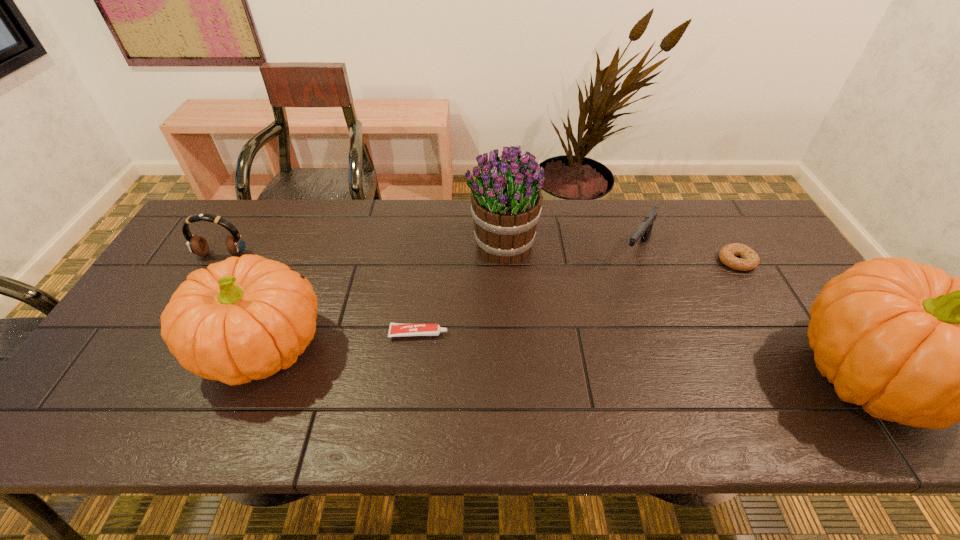
Where is `vacant space located 0.140m on the surface of the third tallest object`? The image size is (960, 540). vacant space located 0.140m on the surface of the third tallest object is located at coordinates (383, 347).

Locate an element on the screen. The image size is (960, 540). vacant space located at the muzzle of the fifth tallest object is located at coordinates (655, 303).

Find the location of `vacant space located on the right of the fourth object from left to right`. vacant space located on the right of the fourth object from left to right is located at coordinates (570, 245).

I want to click on vacant space situated on the ear cup of the headset, so click(167, 349).

The image size is (960, 540). I want to click on blank area located 0.340m on the front of the bagel, so click(804, 375).

Identify the location of free region located 0.390m at the nozzle of the fifth object from right to left. (599, 333).

Where is `gun that is at the far edge`? Image resolution: width=960 pixels, height=540 pixels. gun that is at the far edge is located at coordinates (644, 230).

Image resolution: width=960 pixels, height=540 pixels. What are the coordinates of `bouquet that is at the far edge` in the screenshot? It's located at (506, 198).

Where is `object present at the near edge`? object present at the near edge is located at coordinates (244, 318).

Image resolution: width=960 pixels, height=540 pixels. In order to click on object that is at the left edge in this screenshot , I will do `click(197, 244)`.